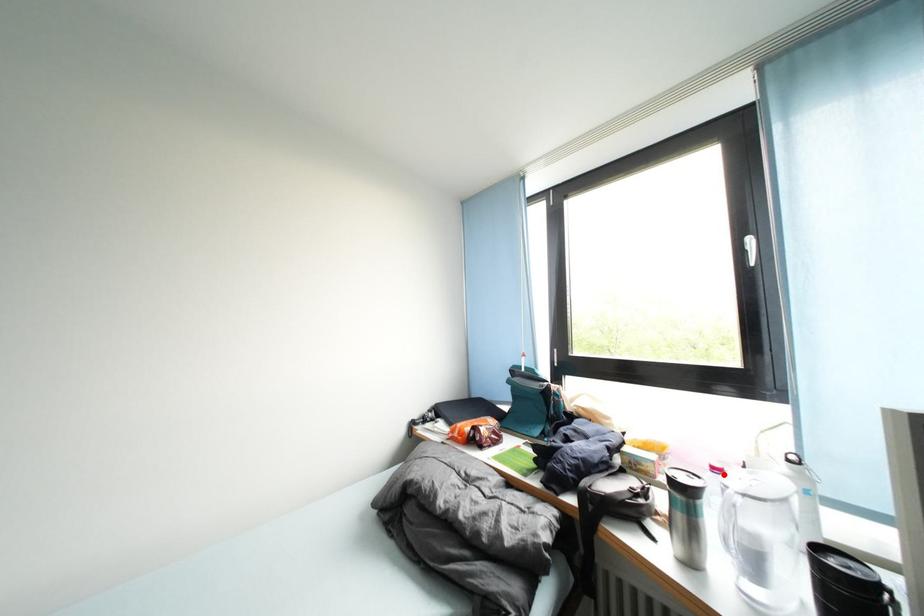
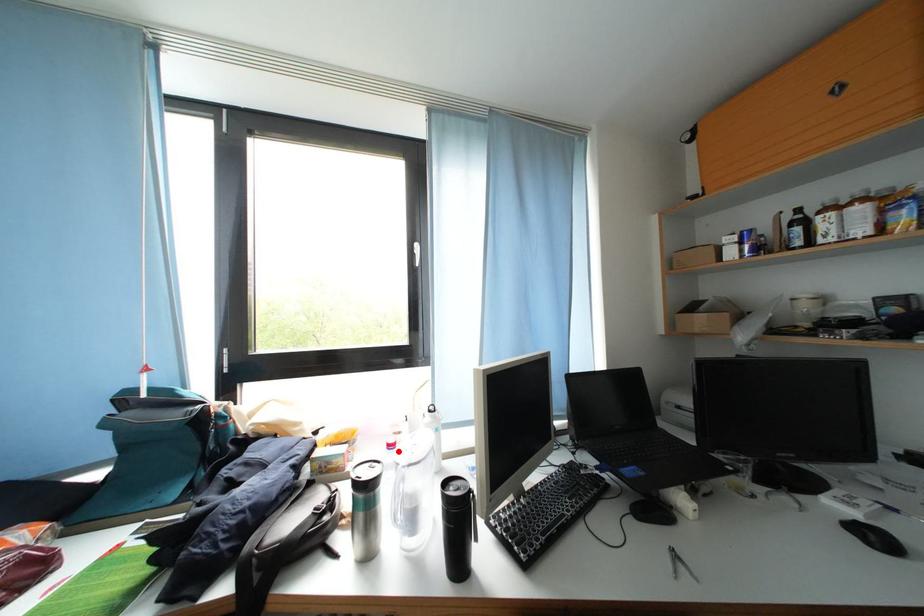
I am providing you with two images of the same scene from different viewpoints. A red point is marked on the first image and another point is marked on the second image. Is the red point in image1 aligned with the point shown in image2?

Yes